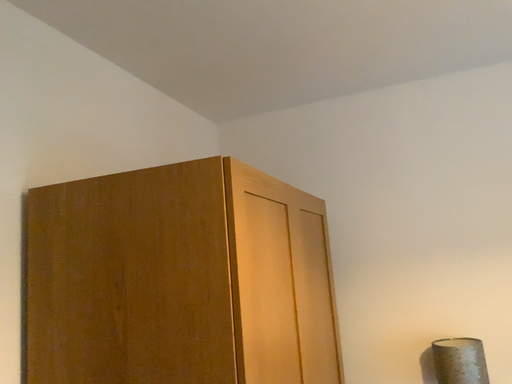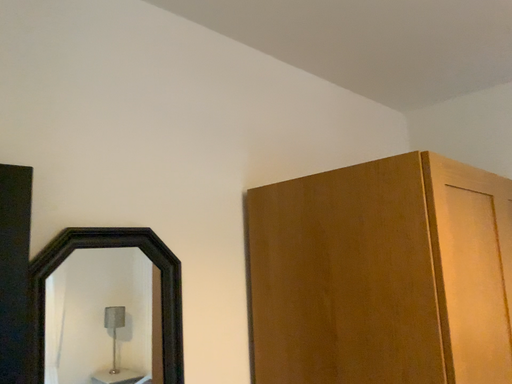
Question: Which way did the camera rotate in the video?

Choices:
 (A) rotated right
 (B) rotated left

Answer: (B)